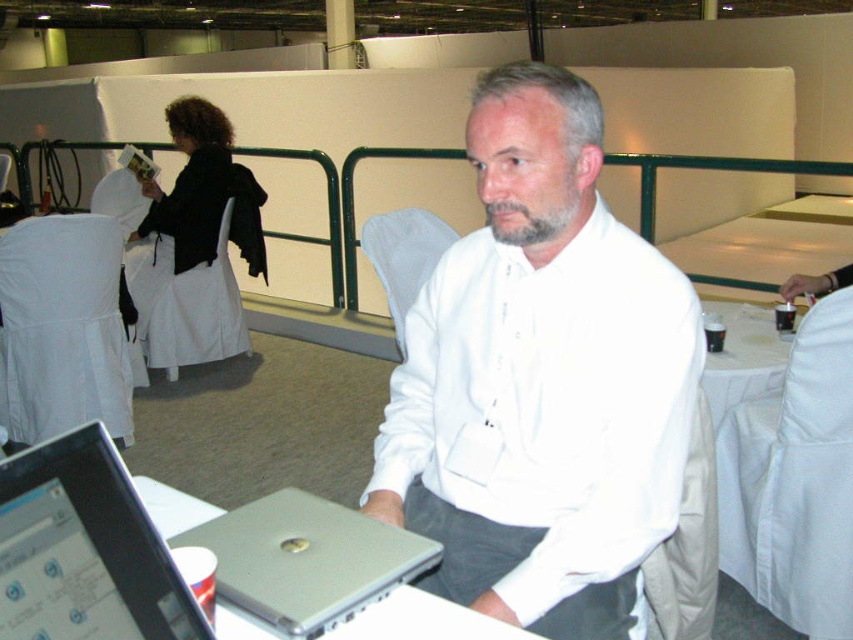
Is silver metallic laptop at lower center taller than white cloth at right?

No.

Does silver metallic laptop at lower center appear on the right side of white cloth at right?

Incorrect, silver metallic laptop at lower center is not on the right side of white cloth at right.

Who is more forward, (53, 484) or (766, 321)?

Positioned in front is point (53, 484).

I want to click on silver metallic laptop at lower center, so click(x=84, y=548).

Which is behind, point (212, 544) or point (729, 404)?

The point (729, 404) is more distant.

Between silver metallic laptop at lower left and white cloth at right, which one is positioned lower?

silver metallic laptop at lower left is lower down.

Measure the distance between point (427, 540) and camera.

A distance of 3.65 feet exists between point (427, 540) and camera.

Identify the location of silver metallic laptop at lower left. This screenshot has width=853, height=640. (306, 561).

Is silver metallic laptop at lower center thinner than silver metallic laptop at lower left?

Indeed, silver metallic laptop at lower center has a lesser width compared to silver metallic laptop at lower left.

Can you confirm if silver metallic laptop at lower center is positioned below silver metallic laptop at lower left?

No, silver metallic laptop at lower center is not below silver metallic laptop at lower left.

Between point (30, 621) and point (361, 588), which one is positioned behind?

Positioned behind is point (361, 588).

Find the location of a particular element. The width and height of the screenshot is (853, 640). silver metallic laptop at lower center is located at coordinates 84,548.